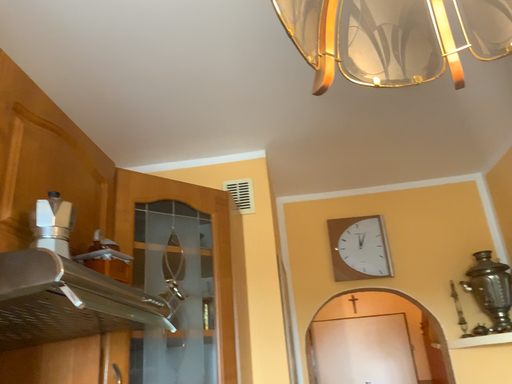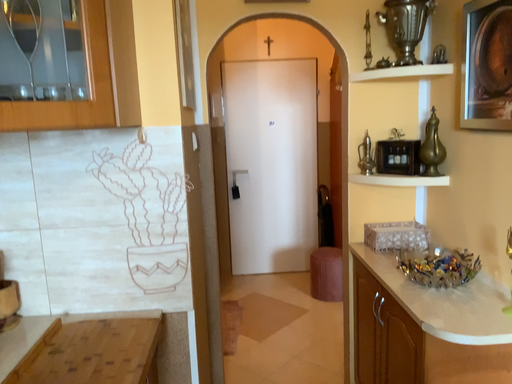
Question: Which way did the camera rotate in the video?

Choices:
 (A) rotated downward
 (B) rotated upward

Answer: (A)